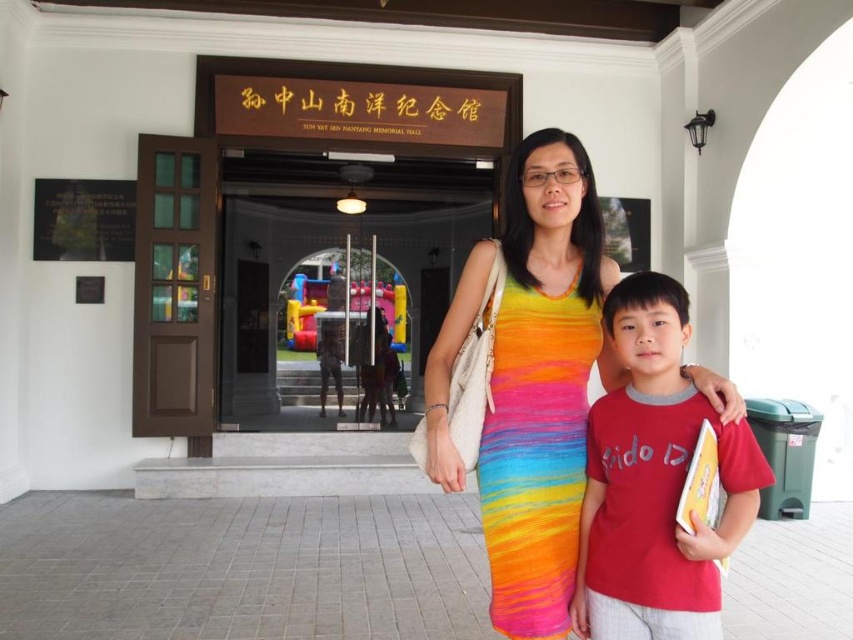
You are standing in front of the building entrance and want to locate two specific points marked in the image. The first point is at coordinates point (x=548, y=360) and the second point is at point (x=335, y=211). Which point is closer to you?

Point (x=548, y=360) is closer to the viewer than point (x=335, y=211).